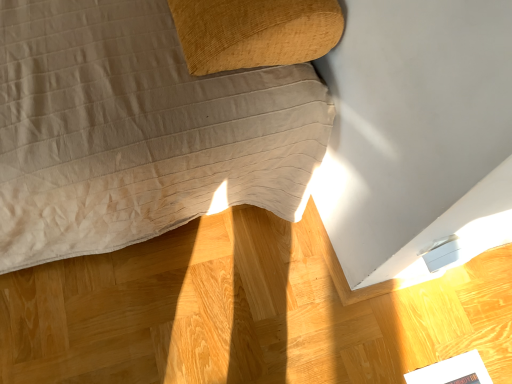
Question: In terms of height, does wooden table at center look taller or shorter compared to white glossy magazine at lower right?

Choices:
 (A) short
 (B) tall

Answer: (B)

Question: From the image's perspective, is wooden table at center positioned above or below white glossy magazine at lower right?

Choices:
 (A) above
 (B) below

Answer: (A)

Question: Looking at their shapes, would you say wooden table at center is wider or thinner than white glossy magazine at lower right?

Choices:
 (A) thin
 (B) wide

Answer: (B)

Question: Considering the relative positions of white glossy magazine at lower right and wooden table at center in the image provided, is white glossy magazine at lower right to the left or to the right of wooden table at center?

Choices:
 (A) right
 (B) left

Answer: (A)

Question: From a real-world perspective, relative to wooden table at center, is white glossy magazine at lower right vertically above or below?

Choices:
 (A) below
 (B) above

Answer: (A)

Question: Considering the positions of white glossy magazine at lower right and wooden table at center in the image, is white glossy magazine at lower right wider or thinner than wooden table at center?

Choices:
 (A) thin
 (B) wide

Answer: (A)

Question: Is white glossy magazine at lower right inside the boundaries of wooden table at center, or outside?

Choices:
 (A) inside
 (B) outside

Answer: (B)